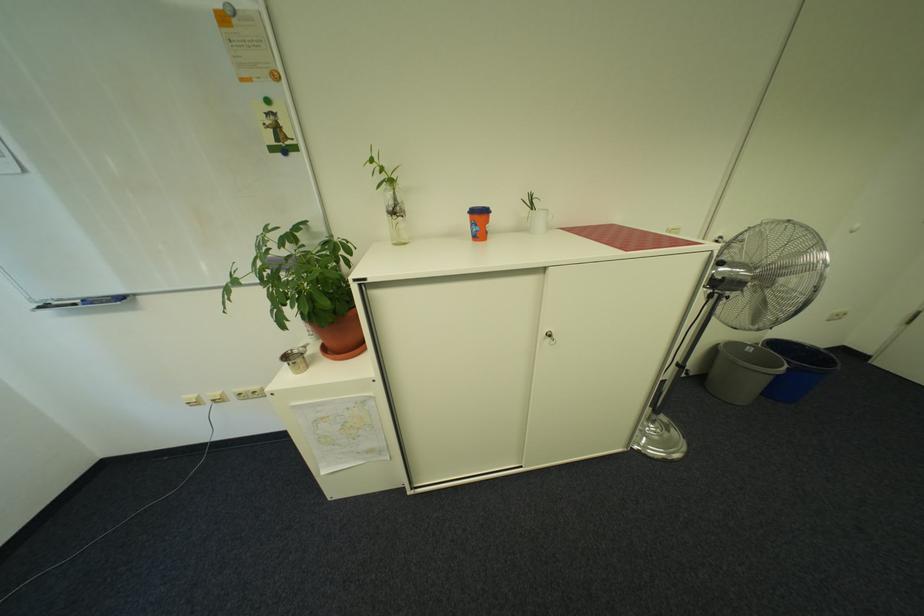
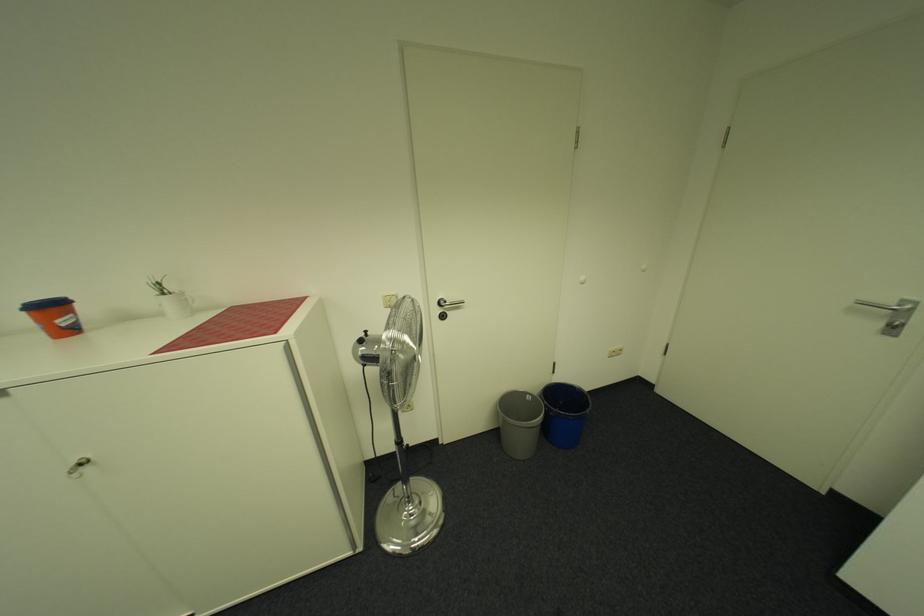
Locate, in the second image, the point that corresponds to the point at 541,211 in the first image.

(173, 294)